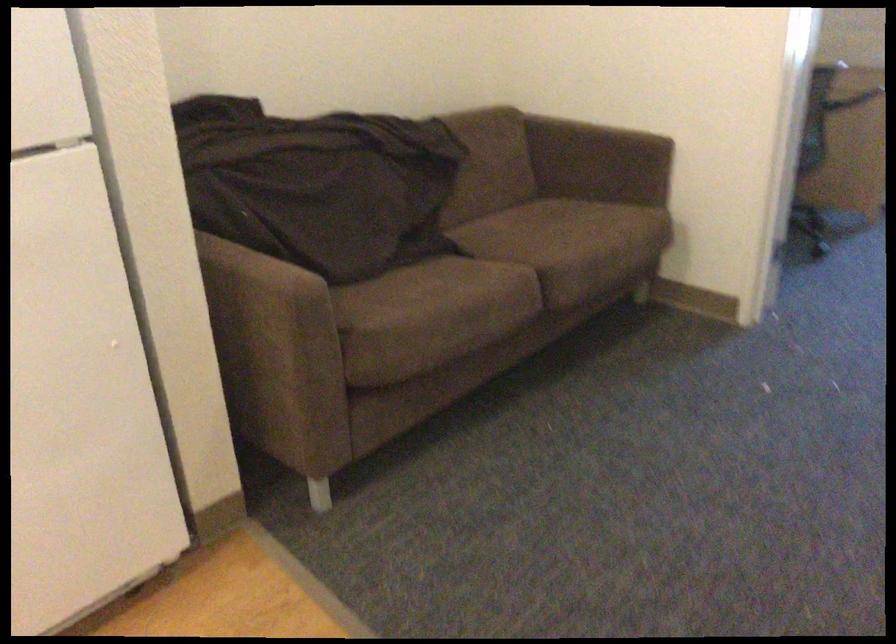
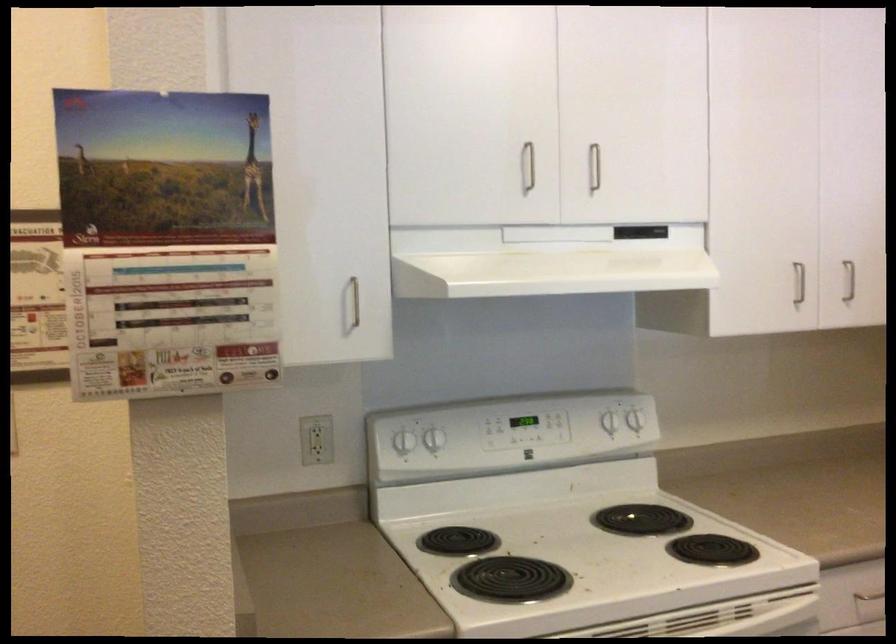
The first image is from the beginning of the video and the second image is from the end. How did the camera likely rotate when shooting the video?

The camera rotated toward left-down.